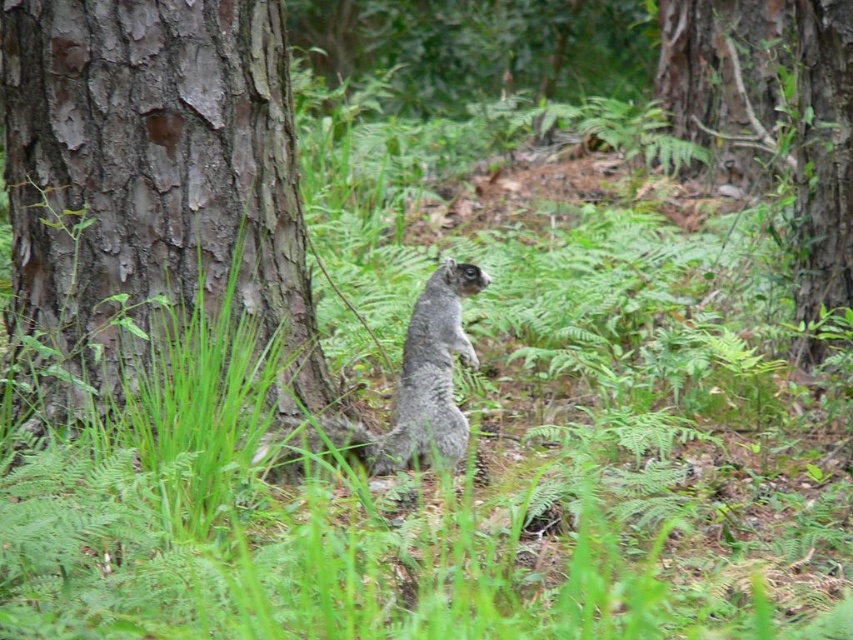
Find the location of a particular element. The width and height of the screenshot is (853, 640). brown rough bark tree trunk at left is located at coordinates (152, 184).

Does brown rough bark tree trunk at left have a lesser height compared to rough bark tree at center?

No.

Is point (106, 180) behind point (795, 40)?

No.

The width and height of the screenshot is (853, 640). What are the coordinates of `brown rough bark tree trunk at left` in the screenshot? It's located at (152, 184).

Which is more to the right, rough bark tree at center or gray furry squirrel at center?

Positioned to the right is rough bark tree at center.

Between rough bark tree at center and gray furry squirrel at center, which one is positioned lower?

gray furry squirrel at center is below.

The image size is (853, 640). What do you see at coordinates (775, 109) in the screenshot? I see `rough bark tree at center` at bounding box center [775, 109].

Locate an element on the screen. This screenshot has height=640, width=853. rough bark tree at center is located at coordinates (775, 109).

Image resolution: width=853 pixels, height=640 pixels. What do you see at coordinates (152, 184) in the screenshot?
I see `brown rough bark tree trunk at left` at bounding box center [152, 184].

Between point (283, 324) and point (444, 349), which one is positioned behind?

Positioned behind is point (444, 349).

Identify the location of brown rough bark tree trunk at left. (152, 184).

The image size is (853, 640). Identify the location of brown rough bark tree trunk at left. (152, 184).